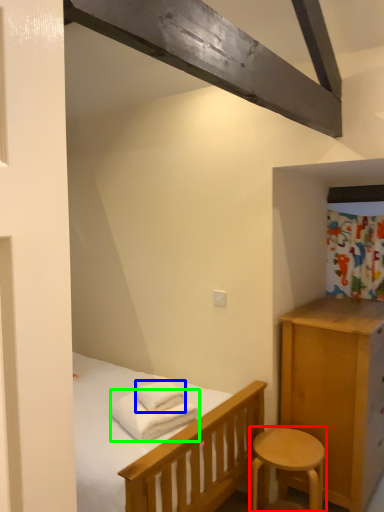
Question: Which object is the closest to the stool (highlighted by a red box)? Choose among these: bath towel (highlighted by a blue box) or bath towel (highlighted by a green box).

Choices:
 (A) bath towel
 (B) bath towel

Answer: (B)